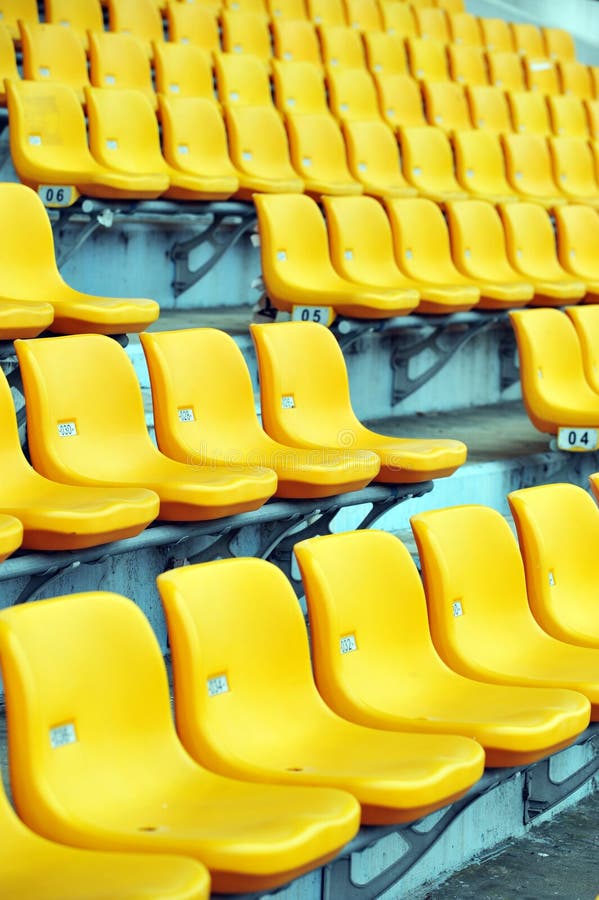
This screenshot has height=900, width=599. I want to click on brackets supporting seats, so (331, 886), (549, 793), (49, 578), (216, 549), (316, 527), (444, 355), (510, 366), (347, 338), (217, 248), (71, 244).